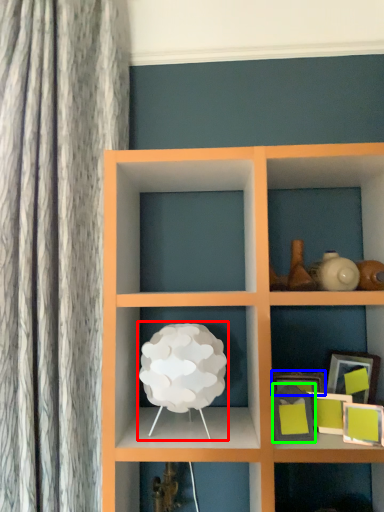
Question: Which object is the farthest from table lamp (highlighted by a red box)? Choose among these: picture frame (highlighted by a blue box) or picture frame (highlighted by a green box).

Choices:
 (A) picture frame
 (B) picture frame

Answer: (A)